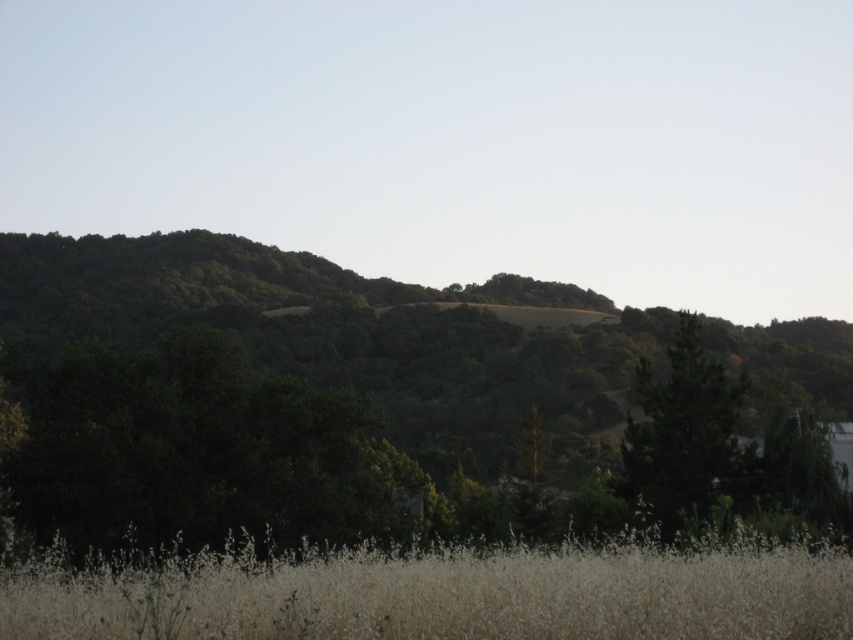
Question: Which object is closer to the camera taking this photo?

Choices:
 (A) green leafy tree at center
 (B) green matte tree at right

Answer: (A)

Question: Which point is closer to the camera?

Choices:
 (A) white soft grass at lower center
 (B) green matte tree at right

Answer: (A)

Question: Where is white soft grass at lower center located in relation to green matte tree at right in the image?

Choices:
 (A) below
 (B) above

Answer: (B)

Question: Does white soft grass at lower center lie in front of green matte tree at right?

Choices:
 (A) yes
 (B) no

Answer: (A)

Question: Estimate the real-world distances between objects in this image. Which object is closer to the green matte tree at right?

Choices:
 (A) green leafy tree at center
 (B) white soft grass at lower center

Answer: (B)

Question: Is white soft grass at lower center to the left of green matte tree at right from the viewer's perspective?

Choices:
 (A) no
 (B) yes

Answer: (B)